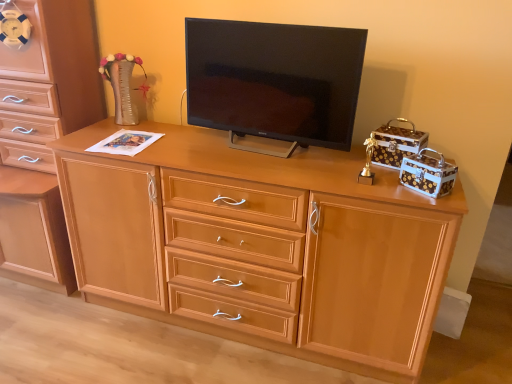
Image resolution: width=512 pixels, height=384 pixels. What are the coordinates of `vacant area on top of light wood cabinet at center (from a real-world perspective)` in the screenshot? It's located at (246, 150).